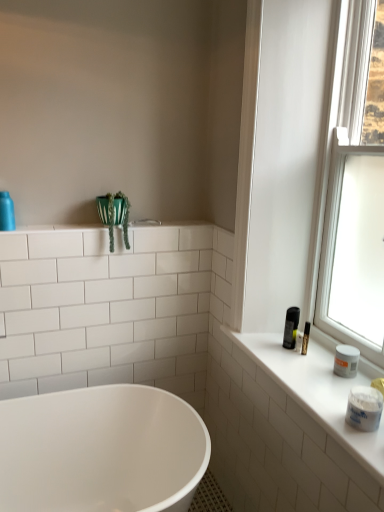
Image resolution: width=384 pixels, height=512 pixels. I want to click on free space above white matte counter top at right (from a real-world perspective), so click(320, 365).